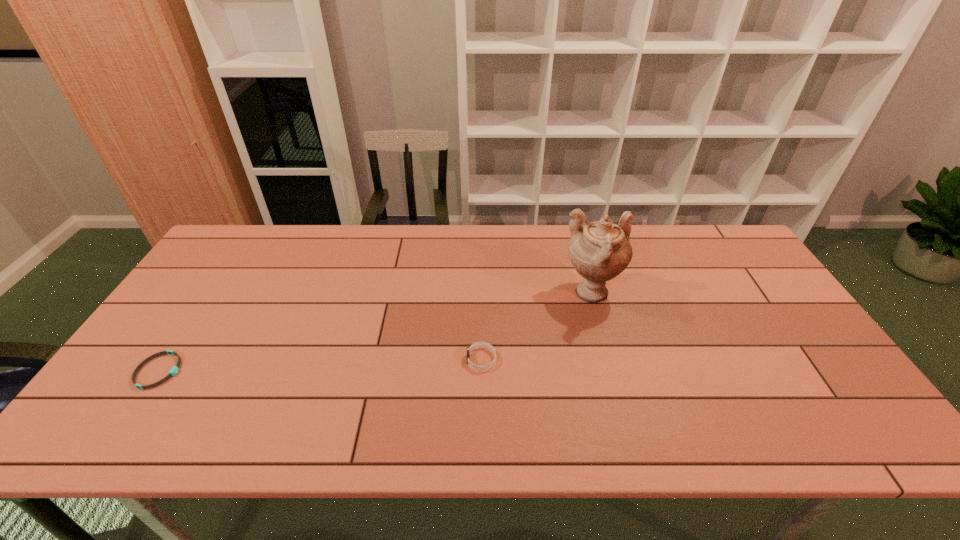
Identify the location of the farthest object. (599, 251).

Find the location of a particular element. The width and height of the screenshot is (960, 540). the tallest object is located at coordinates (599, 251).

The height and width of the screenshot is (540, 960). Find the location of `the second object from right to left`. the second object from right to left is located at coordinates [478, 344].

In order to click on the second tallest object in this screenshot , I will do `click(478, 344)`.

Locate an element on the screen. the leftmost object is located at coordinates (174, 370).

You are a GUI agent. You are given a task and a screenshot of the screen. Output one action in this format:
    pyautogui.click(x=<x>, y=<y>)
    Task: Click on the shorter wristband
    
    Given the screenshot: What is the action you would take?
    pyautogui.click(x=174, y=370)

The width and height of the screenshot is (960, 540). What are the coordinates of `blank area located on the left of the rightmost object` in the screenshot? It's located at click(x=540, y=294).

Identify the location of free space located on the outer surface of the second tallest object. This screenshot has width=960, height=540. (417, 359).

At what (x,y) coordinates should I click in order to perform the action: click on free space located 0.080m on the outer surface of the second tallest object. Please return your answer as a coordinate pair (x, y). Looking at the image, I should click on (436, 359).

Identify the location of vacant area situated 0.200m on the outer surface of the second tallest object. (389, 359).